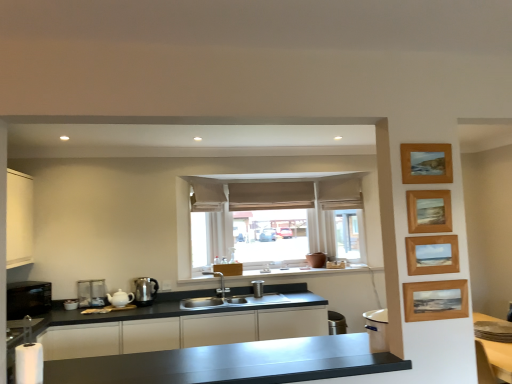
Find the location of a particular element. free space above beige fabric curtain at center, which appears as the second curtain when viewed from the left (from a real-world perspective) is located at coordinates (269, 183).